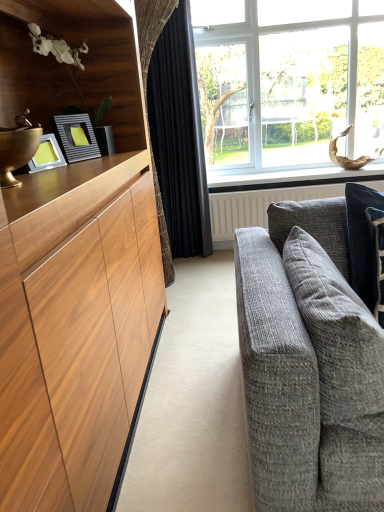
Question: From a real-world perspective, is white textured radiator at center positioned over white painted wood at upper center based on gravity?

Choices:
 (A) no
 (B) yes

Answer: (A)

Question: Can you confirm if white textured radiator at center is positioned to the left of white painted wood at upper center?

Choices:
 (A) no
 (B) yes

Answer: (B)

Question: Does white textured radiator at center turn towards white painted wood at upper center?

Choices:
 (A) yes
 (B) no

Answer: (B)

Question: Considering the relative positions of white textured radiator at center and white painted wood at upper center in the image provided, is white textured radiator at center in front of white painted wood at upper center?

Choices:
 (A) yes
 (B) no

Answer: (A)

Question: Does white textured radiator at center appear on the right side of white painted wood at upper center?

Choices:
 (A) yes
 (B) no

Answer: (B)

Question: Is black velvet curtain at center wider or thinner than dark blue textured pillow at right, acting as the 2th pillow starting from the left?

Choices:
 (A) thin
 (B) wide

Answer: (B)

Question: From a real-world perspective, is black velvet curtain at center above or below dark blue textured pillow at right, the 1th pillow in the right-to-left sequence?

Choices:
 (A) below
 (B) above

Answer: (B)

Question: In terms of height, does black velvet curtain at center look taller or shorter compared to dark blue textured pillow at right, the 1th pillow in the right-to-left sequence?

Choices:
 (A) short
 (B) tall

Answer: (B)

Question: From the image's perspective, is black velvet curtain at center positioned above or below dark blue textured pillow at right, the 1th pillow in the right-to-left sequence?

Choices:
 (A) above
 (B) below

Answer: (A)

Question: Looking at their shapes, would you say white textured radiator at center is wider or thinner than clear glass window at upper right?

Choices:
 (A) thin
 (B) wide

Answer: (A)

Question: Looking at the image, does white textured radiator at center seem bigger or smaller compared to clear glass window at upper right?

Choices:
 (A) small
 (B) big

Answer: (A)

Question: Considering their positions, is white textured radiator at center located in front of or behind clear glass window at upper right?

Choices:
 (A) front
 (B) behind

Answer: (B)

Question: From a real-world perspective, is white textured radiator at center positioned above or below clear glass window at upper right?

Choices:
 (A) above
 (B) below

Answer: (B)

Question: Is metallic silver picture frame at left to the left or to the right of white painted wood at upper center in the image?

Choices:
 (A) right
 (B) left

Answer: (B)

Question: From a real-world perspective, is metallic silver picture frame at left above or below white painted wood at upper center?

Choices:
 (A) below
 (B) above

Answer: (B)